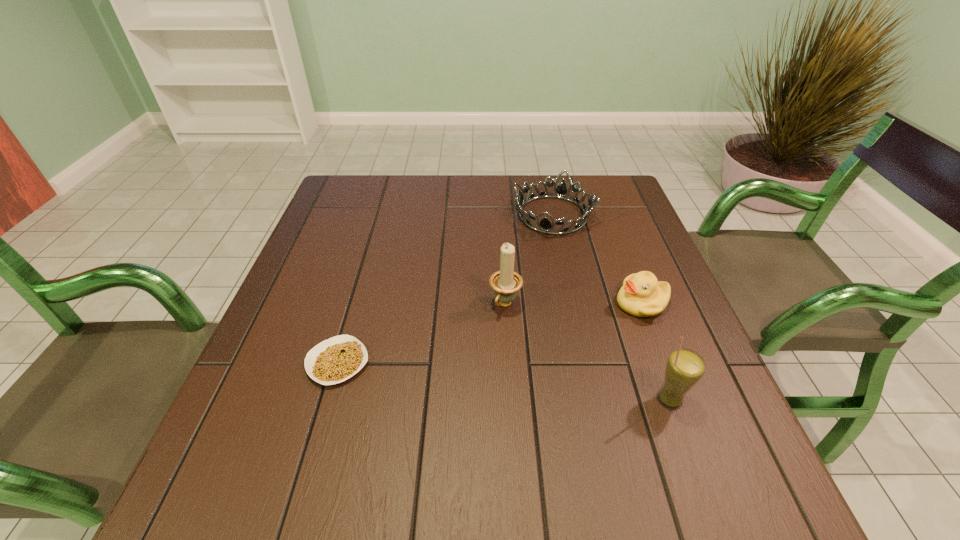
In the image, there is a desktop. Identify the location of vacant area at the far right corner. The height and width of the screenshot is (540, 960). (609, 192).

This screenshot has height=540, width=960. In order to click on blank region between the duckling and the tiara in this screenshot , I will do tap(597, 259).

At what (x,y) coordinates should I click in order to perform the action: click on vacant area that lies between the farthest object and the duckling. Please return your answer as a coordinate pair (x, y). This screenshot has width=960, height=540. Looking at the image, I should click on (597, 259).

Identify the location of unoccupied position between the second object from left to right and the farthest object. click(x=529, y=260).

Where is `free space between the duckling and the straw for drinking`? The image size is (960, 540). free space between the duckling and the straw for drinking is located at coordinates (655, 351).

Identify the location of vacant region between the tiara and the candle_holder. (529, 260).

The width and height of the screenshot is (960, 540). Find the location of `free area in between the fourth object from right to left and the duckling`. free area in between the fourth object from right to left and the duckling is located at coordinates (573, 304).

The height and width of the screenshot is (540, 960). In order to click on free space that is in between the leftmost object and the duckling in this screenshot , I will do `click(490, 333)`.

The height and width of the screenshot is (540, 960). In order to click on vacant area between the leftmost object and the straw for drinking in this screenshot , I will do `click(503, 381)`.

You are a GUI agent. You are given a task and a screenshot of the screen. Output one action in this format:
    pyautogui.click(x=<x>, y=<y>)
    Task: Click on the free space between the straw for drinking and the candle_holder
    
    Given the screenshot: What is the action you would take?
    pyautogui.click(x=587, y=352)